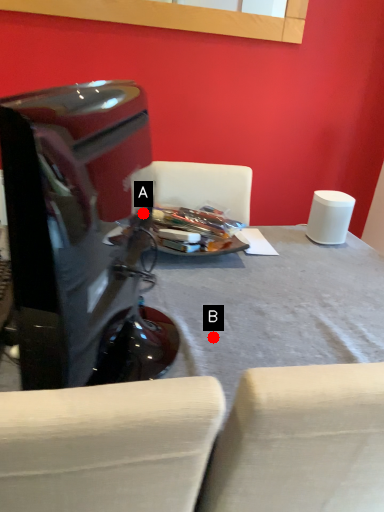
Question: Two points are circled on the image, labeled by A and B beside each circle. Which point appears closest to the camera in this image?

Choices:
 (A) A is closer
 (B) B is closer

Answer: (B)